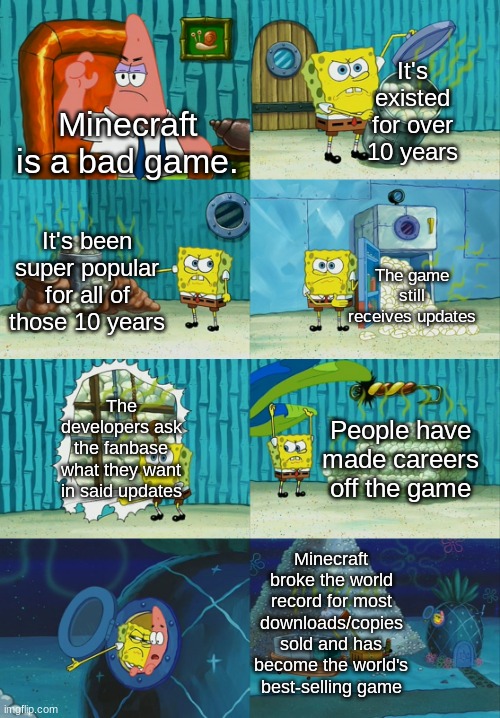
Where is `picture hanging on wall`? This screenshot has height=718, width=500. picture hanging on wall is located at coordinates (201, 42).